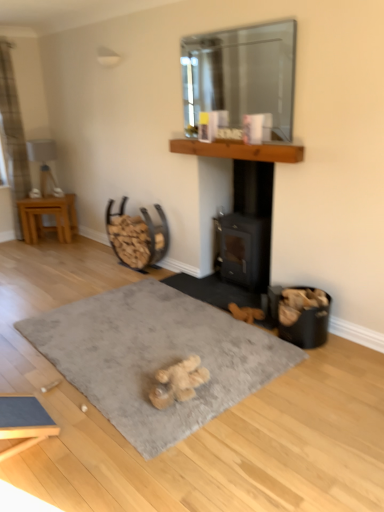
Question: Considering the relative positions of gray soft rug at center and brown wooden mantle at upper center in the image provided, is gray soft rug at center behind brown wooden mantle at upper center?

Choices:
 (A) yes
 (B) no

Answer: (B)

Question: Considering the relative positions of gray soft rug at center and brown wooden mantle at upper center in the image provided, is gray soft rug at center to the right of brown wooden mantle at upper center from the viewer's perspective?

Choices:
 (A) no
 (B) yes

Answer: (A)

Question: Is gray soft rug at center far from brown wooden mantle at upper center?

Choices:
 (A) no
 (B) yes

Answer: (B)

Question: From a real-world perspective, is gray soft rug at center below brown wooden mantle at upper center?

Choices:
 (A) yes
 (B) no

Answer: (A)

Question: Is gray soft rug at center taller than brown wooden mantle at upper center?

Choices:
 (A) no
 (B) yes

Answer: (A)

Question: Is point (221, 50) positioned closer to the camera than point (14, 116)?

Choices:
 (A) closer
 (B) farther

Answer: (A)

Question: Considering their positions, is transparent glass mirror at upper center located in front of or behind plaid fabric curtain at left?

Choices:
 (A) behind
 (B) front

Answer: (B)

Question: Is transparent glass mirror at upper center inside or outside of plaid fabric curtain at left?

Choices:
 (A) inside
 (B) outside

Answer: (B)

Question: In terms of width, does transparent glass mirror at upper center look wider or thinner when compared to plaid fabric curtain at left?

Choices:
 (A) wide
 (B) thin

Answer: (B)

Question: Is fuzzy beige teddy bear at center taller or shorter than plaid fabric curtain at left?

Choices:
 (A) tall
 (B) short

Answer: (B)

Question: Is fuzzy beige teddy bear at center spatially inside plaid fabric curtain at left, or outside of it?

Choices:
 (A) inside
 (B) outside

Answer: (B)

Question: Considering the positions of fuzzy beige teddy bear at center and plaid fabric curtain at left in the image, is fuzzy beige teddy bear at center wider or thinner than plaid fabric curtain at left?

Choices:
 (A) thin
 (B) wide

Answer: (B)

Question: From a real-world perspective, is fuzzy beige teddy bear at center physically located above or below plaid fabric curtain at left?

Choices:
 (A) above
 (B) below

Answer: (B)

Question: In the image, is metallic brown firewood rack at center-left on the left side or the right side of plaid fabric curtain at left?

Choices:
 (A) left
 (B) right

Answer: (B)

Question: Considering the positions of metallic brown firewood rack at center-left and plaid fabric curtain at left in the image, is metallic brown firewood rack at center-left wider or thinner than plaid fabric curtain at left?

Choices:
 (A) wide
 (B) thin

Answer: (A)